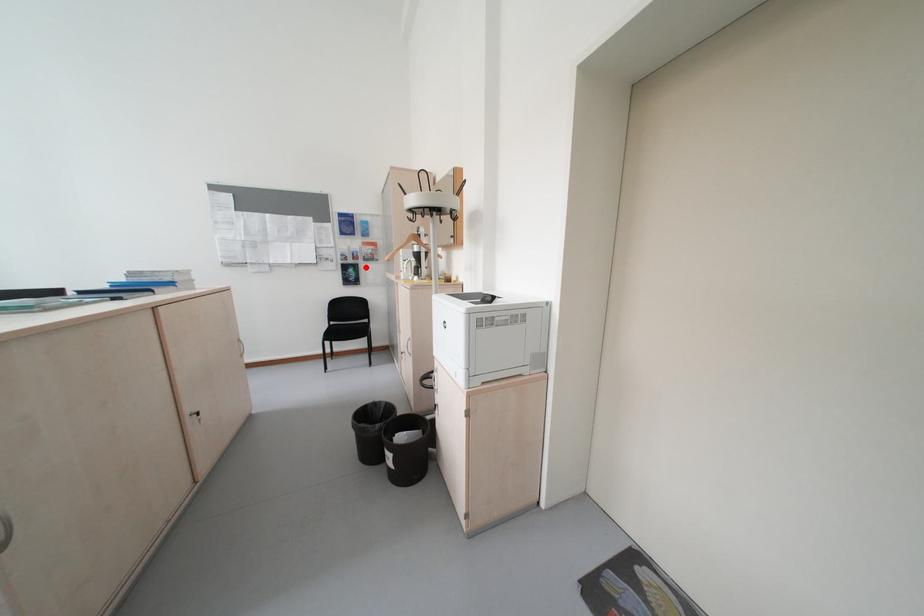
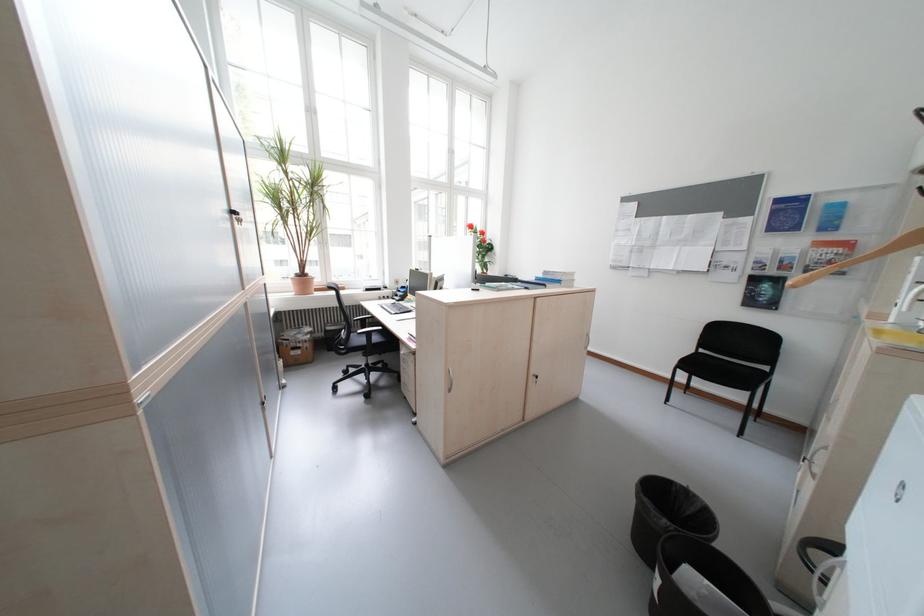
Question: A red point is marked in image1. In image2, is the corresponding 3D point closer to the camera or farther? Reply with the corresponding letter.

Choices:
 (A) The corresponding 3D point is closer.
 (B) The corresponding 3D point is farther.

Answer: (B)